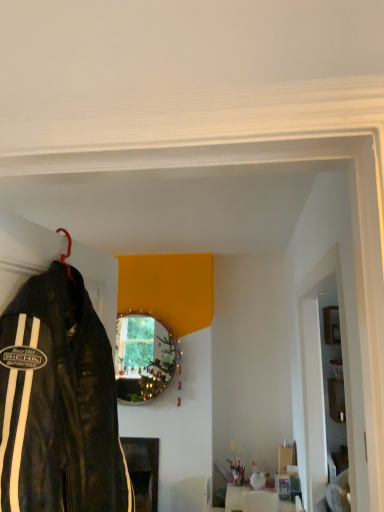
You are a GUI agent. You are given a task and a screenshot of the screen. Output one action in this format:
    pyautogui.click(x=<x>, y=<y>)
    Task: Click on the metallic dark brown fireplace at lower center, the first furniture when ordered from left to right
    
    Given the screenshot: What is the action you would take?
    pyautogui.click(x=143, y=470)

Locate an element on the screen. black leather jacket at left is located at coordinates (59, 402).

How much space does white glossy vase at center, acting as the first furniture starting from the front, occupy horizontally?

white glossy vase at center, acting as the first furniture starting from the front, is 10.71 inches in width.

I want to click on metallic dark brown fireplace at lower center, which is the first furniture in back-to-front order, so click(x=143, y=470).

Which of these two, white glossy vase at center, which is the 1th furniture from right to left, or white glossy door at right, stands taller?

With more height is white glossy door at right.

Considering the sizes of objects white glossy vase at center, acting as the first furniture starting from the front, and white glossy door at right in the image provided, who is bigger, white glossy vase at center, acting as the first furniture starting from the front, or white glossy door at right?

white glossy door at right is bigger.

What's the angular difference between white glossy vase at center, acting as the first furniture starting from the front, and white glossy door at right's facing directions?

The facing directions of white glossy vase at center, acting as the first furniture starting from the front, and white glossy door at right are 91.3 degrees apart.

How many degrees apart are the facing directions of white glossy vase at center, which is the 1th furniture from right to left, and black leather jacket at left?

The angular difference between white glossy vase at center, which is the 1th furniture from right to left, and black leather jacket at left is 98.3 degrees.

The image size is (384, 512). In order to click on jacket on the left of white glossy vase at center, the second furniture in the back-to-front sequence in this screenshot , I will do `click(59, 402)`.

Which object is closer to the camera, white glossy vase at center, the second furniture in the back-to-front sequence, or black leather jacket at left?

black leather jacket at left is more forward.

Is white glossy vase at center, which is the 1th furniture from right to left, aimed at black leather jacket at left?

No.

Is black leather jacket at left positioned with its back to white glossy vase at center, which appears as the second furniture when viewed from the left?

No, white glossy vase at center, which appears as the second furniture when viewed from the left, is not at the back of black leather jacket at left.

Considering the sizes of black leather jacket at left and white glossy vase at center, the second furniture in the back-to-front sequence, in the image, is black leather jacket at left bigger or smaller than white glossy vase at center, the second furniture in the back-to-front sequence,?

Clearly, black leather jacket at left is larger in size than white glossy vase at center, the second furniture in the back-to-front sequence.

In terms of width, does black leather jacket at left look wider or thinner when compared to white glossy vase at center, acting as the first furniture starting from the front?

black leather jacket at left is thinner than white glossy vase at center, acting as the first furniture starting from the front.

From a real-world perspective, is white glossy door at right under white glossy vase at center, which appears as the second furniture when viewed from the left?

No, from a real-world perspective, white glossy door at right is not under white glossy vase at center, which appears as the second furniture when viewed from the left.

Can you tell me how much white glossy door at right and white glossy vase at center, which is the 1th furniture from right to left, differ in facing direction?

The angular difference between white glossy door at right and white glossy vase at center, which is the 1th furniture from right to left, is 91.3 degrees.

From the picture: Do you think white glossy door at right is within white glossy vase at center, acting as the first furniture starting from the front, or outside of it?

white glossy door at right is outside white glossy vase at center, acting as the first furniture starting from the front.

Which object is closer to the camera taking this photo, white glossy door at right or white glossy vase at center, the second furniture in the back-to-front sequence?

Positioned in front is white glossy door at right.

Between metallic reflective mirror at center and white glossy door at right, which one appears on the left side from the viewer's perspective?

Positioned to the left is metallic reflective mirror at center.

Are metallic reflective mirror at center and white glossy door at right far apart?

metallic reflective mirror at center is far away from white glossy door at right.

Considering the sizes of objects metallic reflective mirror at center and white glossy door at right in the image provided, who is taller, metallic reflective mirror at center or white glossy door at right?

white glossy door at right is taller.

Is black leather jacket at left in contact with white glossy door at right?

black leather jacket at left is not next to white glossy door at right, and they're not touching.

From a real-world perspective, who is located higher, black leather jacket at left or white glossy door at right?

In real-world perspective, black leather jacket at left is above.

Which is in front, black leather jacket at left or white glossy door at right?

Positioned in front is black leather jacket at left.

From the image's perspective, is black leather jacket at left over white glossy door at right?

Yes, from the image's perspective, black leather jacket at left is on top of white glossy door at right.

How distant is white glossy door at right from metallic reflective mirror at center?

The distance of white glossy door at right from metallic reflective mirror at center is 4.28 feet.

From a real-world perspective, is white glossy door at right positioned over metallic reflective mirror at center based on gravity?

No, from a real-world perspective, white glossy door at right is not over metallic reflective mirror at center

Is white glossy door at right at the left side of metallic reflective mirror at center?

No.

Is white glossy door at right inside or outside of metallic reflective mirror at center?

The correct answer is: outside.

The image size is (384, 512). In the image, there is a white glossy vase at center, which appears as the second furniture when viewed from the left. In order to click on garage door above it (from the image's perspective) in this screenshot , I will do pyautogui.click(x=319, y=379).

I want to click on jacket in front of the white glossy vase at center, acting as the first furniture starting from the front, so click(x=59, y=402).

Which object lies nearer to the anchor point metallic dark brown fireplace at lower center, acting as the second furniture starting from the front, white glossy door at right or metallic reflective mirror at center?

Based on the image, metallic reflective mirror at center appears to be nearer to metallic dark brown fireplace at lower center, acting as the second furniture starting from the front.

When comparing their distances from metallic dark brown fireplace at lower center, the first furniture when ordered from left to right, does black leather jacket at left or metallic reflective mirror at center seem further?

Based on the image, black leather jacket at left appears to be further to metallic dark brown fireplace at lower center, the first furniture when ordered from left to right.

From the image, which object appears to be farther from metallic reflective mirror at center, white glossy door at right or metallic dark brown fireplace at lower center, which is the first furniture in back-to-front order?

white glossy door at right.

Estimate the real-world distances between objects in this image. Which object is closer to black leather jacket at left, white glossy vase at center, the second furniture in the back-to-front sequence, or metallic reflective mirror at center?

The object closer to black leather jacket at left is metallic reflective mirror at center.

Estimate the real-world distances between objects in this image. Which object is further from black leather jacket at left, white glossy door at right or white glossy vase at center, acting as the first furniture starting from the front?

white glossy vase at center, acting as the first furniture starting from the front, is further to black leather jacket at left.

Looking at the image, which one is located further to white glossy door at right, white glossy vase at center, which is the 1th furniture from right to left, or metallic reflective mirror at center?

Based on the image, metallic reflective mirror at center appears to be further to white glossy door at right.

Which object lies further to the anchor point metallic dark brown fireplace at lower center, the first furniture when ordered from left to right, white glossy vase at center, acting as the first furniture starting from the front, or black leather jacket at left?

black leather jacket at left lies further to metallic dark brown fireplace at lower center, the first furniture when ordered from left to right, than the other object.

When comparing their distances from metallic reflective mirror at center, does metallic dark brown fireplace at lower center, which is the first furniture in back-to-front order, or white glossy vase at center, acting as the first furniture starting from the front, seem closer?

Based on the image, metallic dark brown fireplace at lower center, which is the first furniture in back-to-front order, appears to be nearer to metallic reflective mirror at center.

I want to click on garage door located between black leather jacket at left and metallic dark brown fireplace at lower center, the first furniture when ordered from left to right, in the depth direction, so click(319, 379).

Identify the location of garage door between black leather jacket at left and metallic reflective mirror at center along the z-axis. The width and height of the screenshot is (384, 512). (319, 379).

I want to click on furniture between metallic reflective mirror at center and metallic dark brown fireplace at lower center, the first furniture when ordered from left to right, in the vertical direction, so click(250, 499).

At what (x,y) coordinates should I click in order to perform the action: click on garage door positioned between black leather jacket at left and white glossy vase at center, which is the 1th furniture from right to left, from near to far. Please return your answer as a coordinate pair (x, y). Looking at the image, I should click on (319, 379).